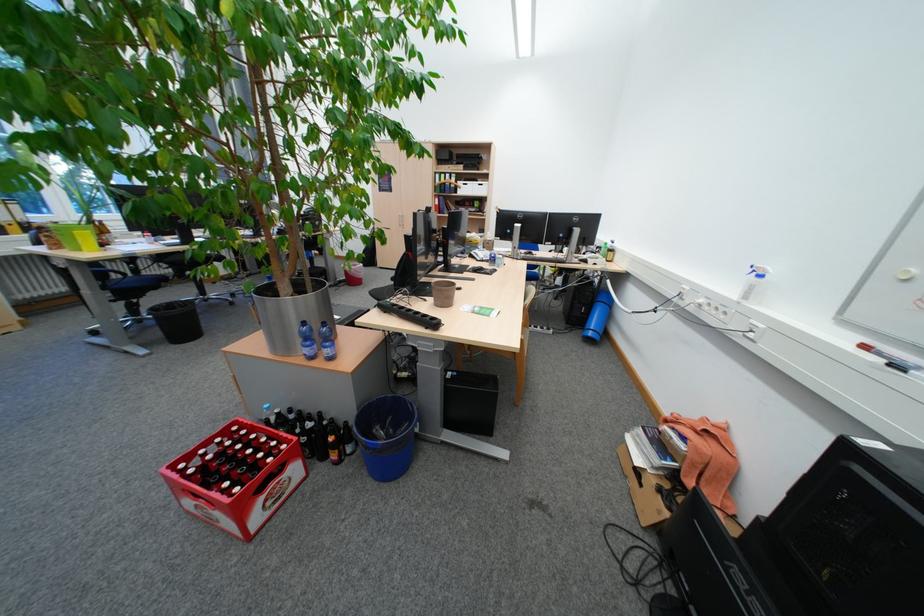
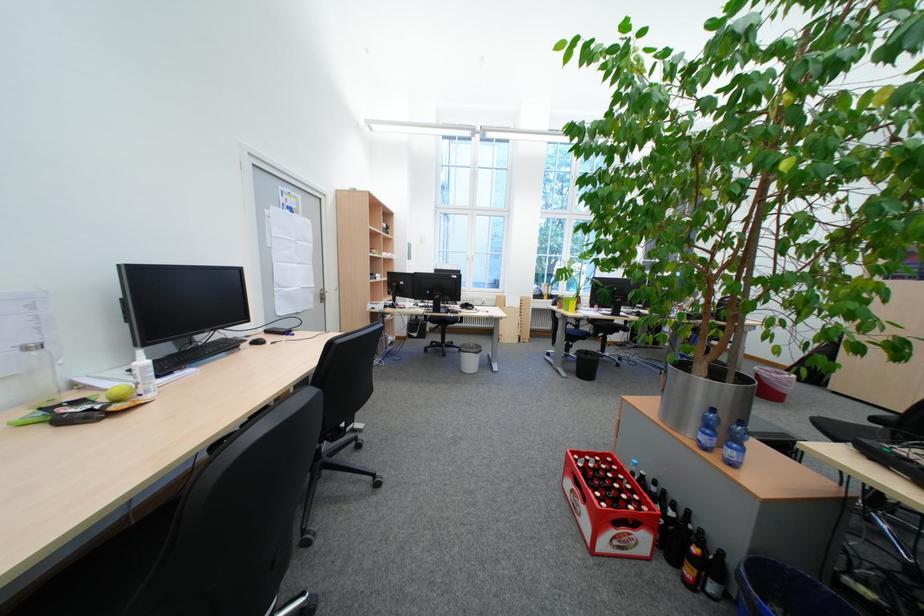
The point at (359, 461) is marked in the first image. Where is the corresponding point in the second image?

(714, 598)